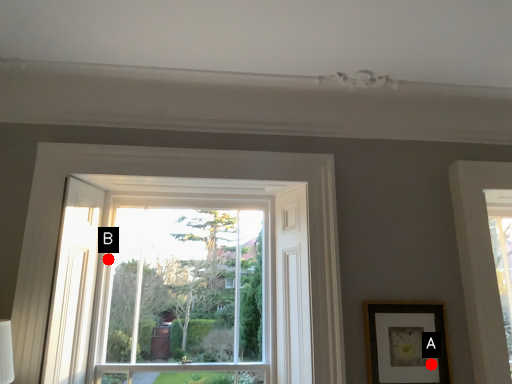
Question: Two points are circled on the image, labeled by A and B beside each circle. Which of the following is the closest to the observer?

Choices:
 (A) A is closer
 (B) B is closer

Answer: (A)